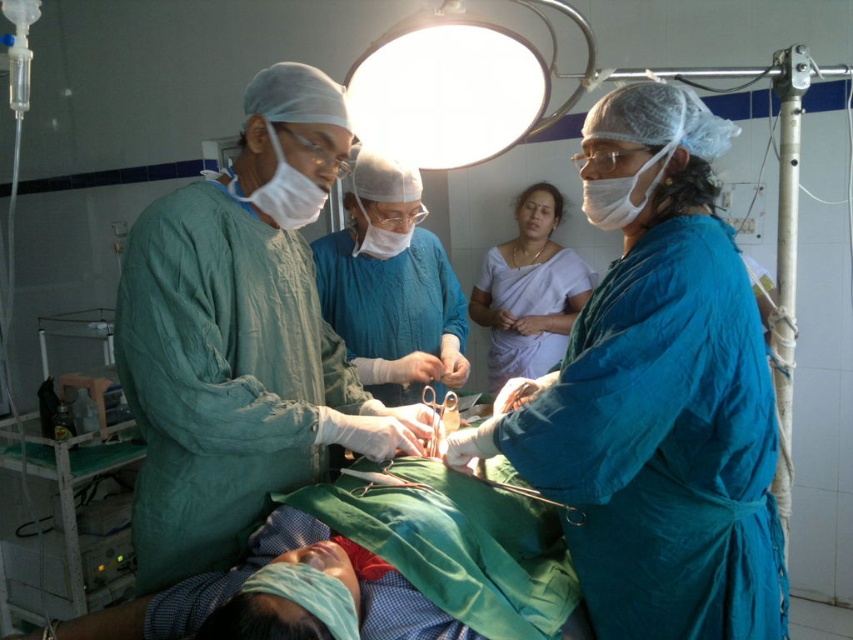
You are a medical student observing the surgical procedure. You notice two items at the center of the scene. Which item is bigger between the white silk saree at center and the surgical scissors at center?

The white silk saree at center is larger in size than the surgical scissors at center, so the white silk saree at center is bigger.

In the operating room scene, there are two medical professionals wearing blue scrubs at center and white silk saree at center. Which one is positioned to the left?

The blue scrubs at center is positioned to the left of the white silk saree at center.

You are a medical student observing the surgery and need to identify the closest point to the camera between point (611, 474) and point (543, 326). Which point is closer?

Point (611, 474) is closer to the camera than point (543, 326).